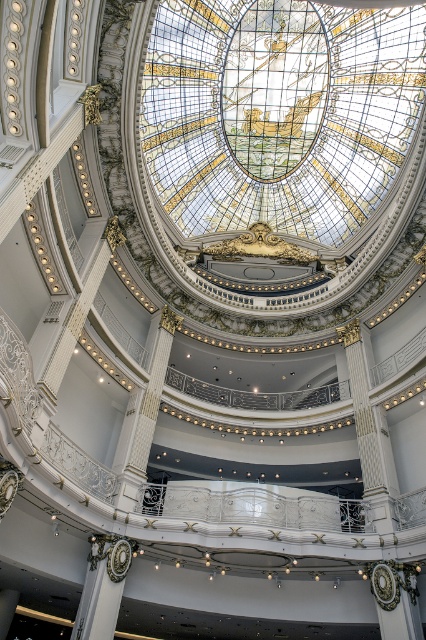
Is gold ornate column at center closer to the viewer compared to white marble column at center?

Yes.

Is gold ornate column at center thinner than white marble column at center?

Yes.

Find the location of a particular element. The height and width of the screenshot is (640, 426). gold ornate column at center is located at coordinates point(103,586).